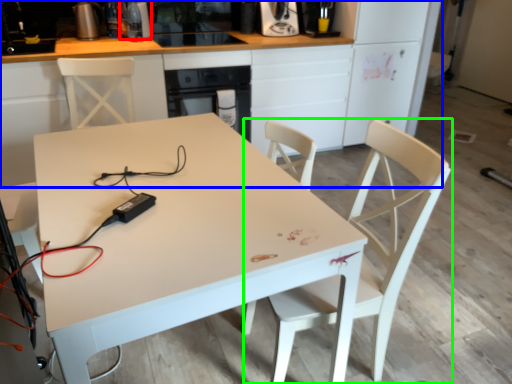
Question: Estimate the real-world distances between objects in this image. Which object is closer to appliance (highlighted by a red box), cabinetry (highlighted by a blue box) or chair (highlighted by a green box)?

Choices:
 (A) cabinetry
 (B) chair

Answer: (A)